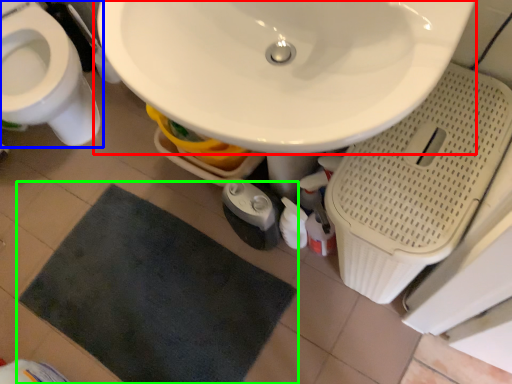
Question: Which is farther away from sink (highlighted by a red box)? toilet (highlighted by a blue box) or bath mat (highlighted by a green box)?

Choices:
 (A) toilet
 (B) bath mat

Answer: (A)